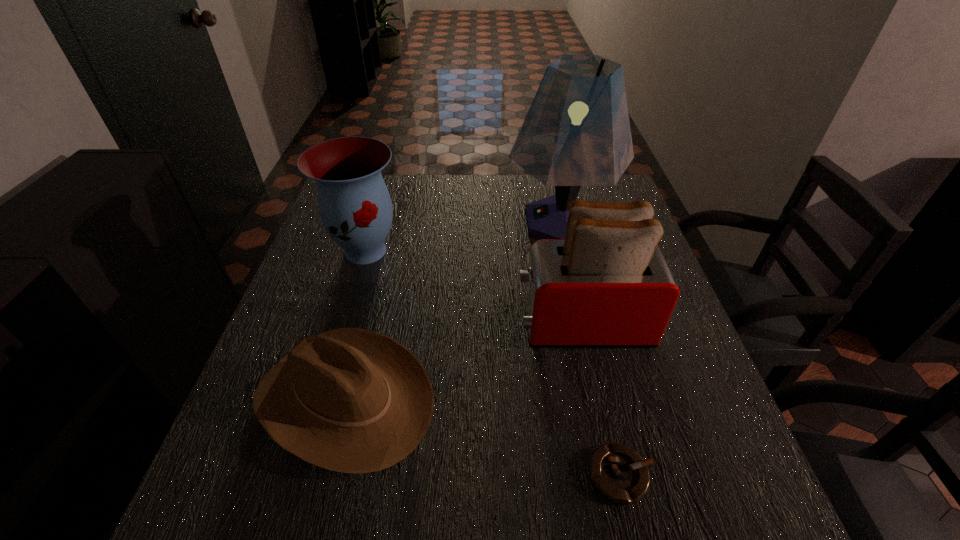
What are the coordinates of `toaster that is at the right edge` in the screenshot? It's located at (606, 285).

This screenshot has width=960, height=540. I want to click on ashtray that is at the right edge, so click(619, 473).

Identify the location of object present at the near left corner. Image resolution: width=960 pixels, height=540 pixels. (351, 400).

At what (x,y) coordinates should I click in order to perform the action: click on object located at the far right corner. Please return your answer as a coordinate pair (x, y). Image resolution: width=960 pixels, height=540 pixels. Looking at the image, I should click on (576, 133).

Locate an element on the screen. object present at the near right corner is located at coordinates (619, 473).

Identify the location of vacant region at the far edge of the desktop. (436, 175).

In the image, there is a desktop. At what (x,y) coordinates should I click in order to perform the action: click on free space at the left edge. Please return your answer as a coordinate pair (x, y). The width and height of the screenshot is (960, 540). Looking at the image, I should click on (239, 464).

Where is `free space at the right edge of the desktop`? free space at the right edge of the desktop is located at coordinates (680, 451).

The width and height of the screenshot is (960, 540). In the image, there is a desktop. Find the location of `vacant space at the near left corner`. vacant space at the near left corner is located at coordinates (238, 483).

At what (x,y) coordinates should I click in order to perform the action: click on free space at the far right corner. Please return your answer as a coordinate pair (x, y). Image resolution: width=960 pixels, height=540 pixels. Looking at the image, I should click on (608, 199).